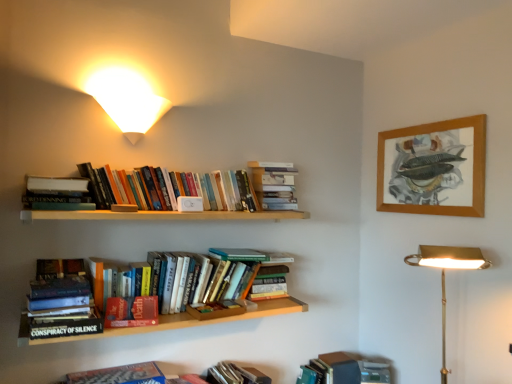
Question: From a real-world perspective, is hardcover book at upper left, the 5th book ordered from the bottom, positioned above or below hardcover book at center, the 6th book in the top-to-bottom sequence?

Choices:
 (A) above
 (B) below

Answer: (A)

Question: Visually, is hardcover book at upper left, the 5th book ordered from the bottom, positioned to the left or to the right of hardcover book at center, the 6th book in the top-to-bottom sequence?

Choices:
 (A) right
 (B) left

Answer: (B)

Question: Estimate the real-world distances between objects in this image. Which object is closer to the hardcover book at upper left, which ranks as the third book in top-to-bottom order?

Choices:
 (A) white matte wall sconce at upper left, which is the 1th lamp in top-to-bottom order
 (B) gold brass desk lamp at lower right, acting as the first lamp starting from the bottom
 (C) hardcover book at lower right, placed as the 1th book when sorted from bottom to top
 (D) hardcover book at center, placed as the fifth book when sorted from top to bottom
 (E) hardcover book at lower left, the fourth book when ordered from top to bottom

Answer: (E)

Question: Considering the real-world distances, which object is closest to the wooden picture frame at upper right?

Choices:
 (A) hardcover book at lower right, the seventh book viewed from the top
 (B) white matte wall sconce at upper left, the second lamp ordered from the bottom
 (C) gold brass desk lamp at lower right, acting as the 2th lamp starting from the left
 (D) hardcover book at center, placed as the fifth book when sorted from top to bottom
 (E) hardcover book at upper left, which ranks as the third book in top-to-bottom order

Answer: (C)